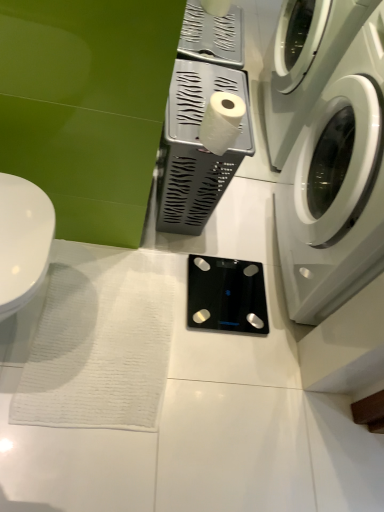
At what (x,y) coordinates should I click in order to perform the action: click on free area in between black glass scale at center, acting as the 2th appliance starting from the top, and white plastic tissue holder at center, which appears as the 2th appliance when ordered from the bottom. Please return your answer as a coordinate pair (x, y). Looking at the image, I should click on (207, 247).